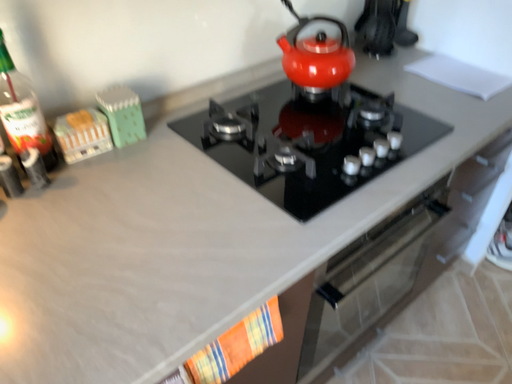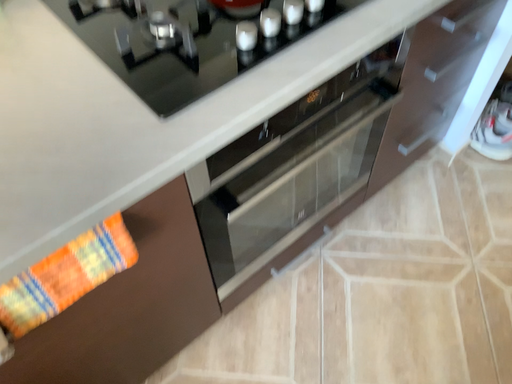
Question: How did the camera likely rotate when shooting the video?

Choices:
 (A) rotated upward
 (B) rotated downward

Answer: (B)